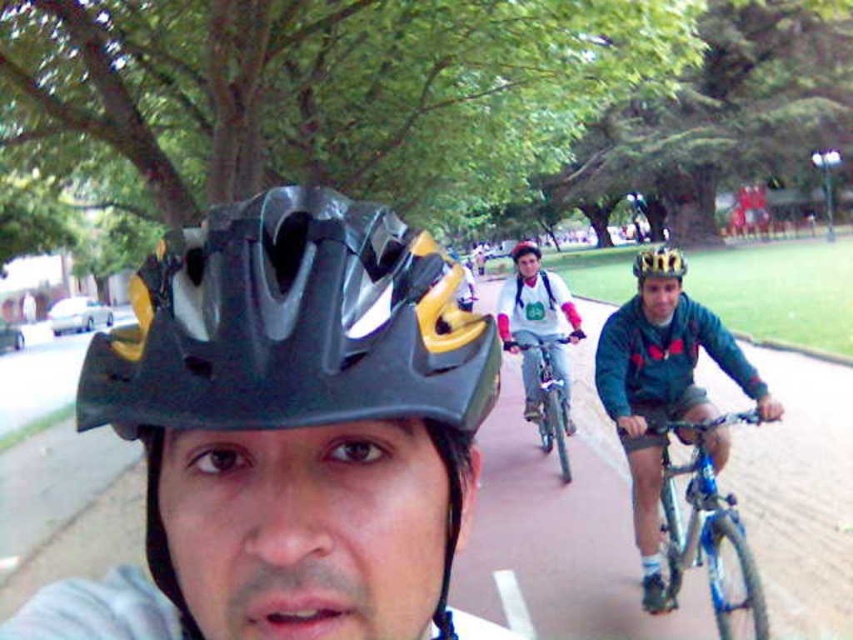
You are a cyclist who wants to choose a helmet that takes up less space in your backpack. You have two options in the scene, the black matte bicycle helmet at center and the gold matte helmet at center. Which helmet should you choose?

The black matte bicycle helmet at center occupies less space than the gold matte helmet at center, so you should choose the black matte bicycle helmet at center.

Based on the photo, you are a cyclist observing the scene and want to know which helmet is closer to you between the black matte bicycle helmet at center and the gold textured helmet at center. Based on their positions, which one is closer?

The black matte bicycle helmet at center is closer to you because it is positioned in front of the gold textured helmet at center.

You are a cyclist who wants to overtake the matte black helmet at center ahead. The matte blue bicycle at right is in your path. Can you safely pass them if your speed is 15 kmph and the required safe overtaking distance is 4 meters?

The distance between the matte blue bicycle at right and the matte black helmet at center is 3.40 meters. Since the required safe overtaking distance is 4 meters, you do not have enough space to safely overtake at this moment. Wait for a longer gap before attempting to pass.